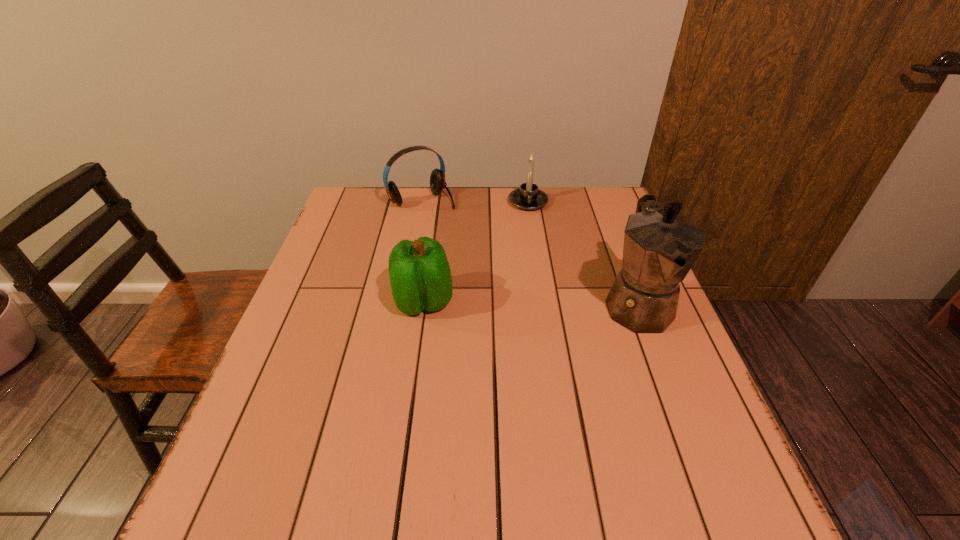
Where is `free space at the left edge`? The width and height of the screenshot is (960, 540). free space at the left edge is located at coordinates (312, 286).

Find the location of a particular element. Image resolution: width=960 pixels, height=540 pixels. vacant space at the right edge is located at coordinates (616, 240).

Identify the location of vacant area at the far left corner. (353, 224).

Locate an element on the screen. free spot at the far right corner of the desktop is located at coordinates (596, 208).

I want to click on free space that is in between the bell pepper and the third object from left to right, so click(475, 252).

The image size is (960, 540). I want to click on vacant space that's between the rightmost object and the headset, so click(x=530, y=252).

The width and height of the screenshot is (960, 540). Find the location of `free space between the coffeepot and the second object from right to left`. free space between the coffeepot and the second object from right to left is located at coordinates (583, 253).

Locate an element on the screen. unoccupied area between the rightmost object and the headset is located at coordinates (530, 252).

Locate an element on the screen. The width and height of the screenshot is (960, 540). free point between the bell pepper and the second object from right to left is located at coordinates (475, 252).

Locate an element on the screen. The image size is (960, 540). free point between the bell pepper and the rightmost object is located at coordinates (530, 303).